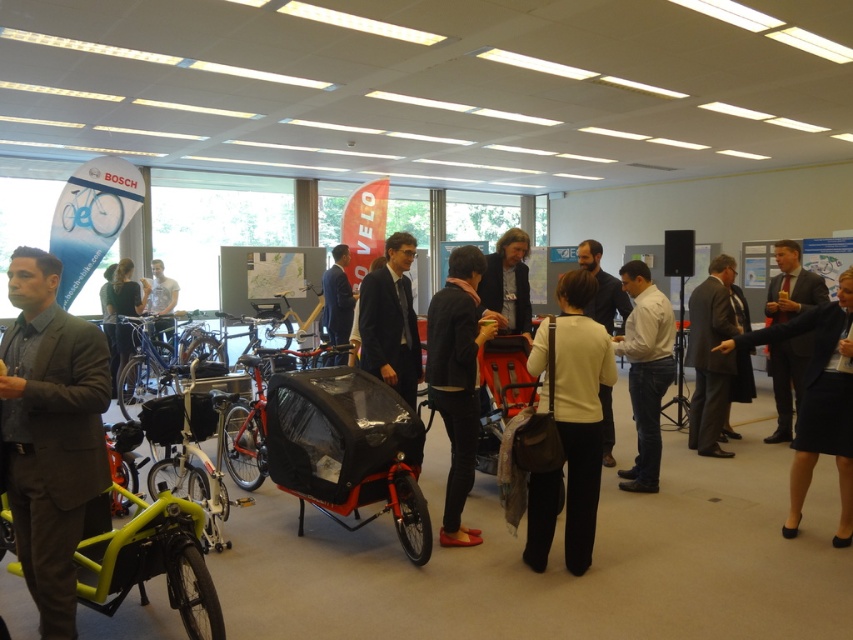
Question: Does light beige fabric jacket at center appear under matte blue bicycle at upper left?

Choices:
 (A) yes
 (B) no

Answer: (A)

Question: Considering the real-world distances, which object is farthest from the dark gray suit at center?

Choices:
 (A) dark brown leather jacket at center
 (B) matte black jacket at center

Answer: (A)

Question: Which of the following is the closest to the observer?

Choices:
 (A) (784, 362)
 (B) (589, 433)
 (C) (158, 364)

Answer: (B)

Question: Is dark gray suit at right to the right of matte blue bicycle at upper left from the viewer's perspective?

Choices:
 (A) no
 (B) yes

Answer: (B)

Question: Does light beige sweater at center appear on the right side of light blue shirt at center?

Choices:
 (A) yes
 (B) no

Answer: (A)

Question: Among these objects, which one is farthest from the camera?

Choices:
 (A) dark gray suit at center
 (B) light blue shirt at center
 (C) dark blue skirt at center
 (D) matte black cargo bike at center

Answer: (B)